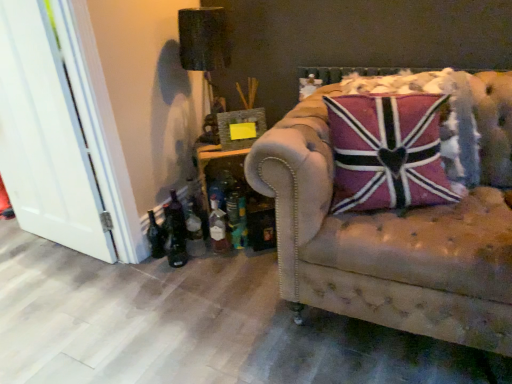
The width and height of the screenshot is (512, 384). What are the coordinates of `vacant space situated on the left part of translucent glass bottle at lower left, the 1th bottle viewed from the right` in the screenshot? It's located at (197, 246).